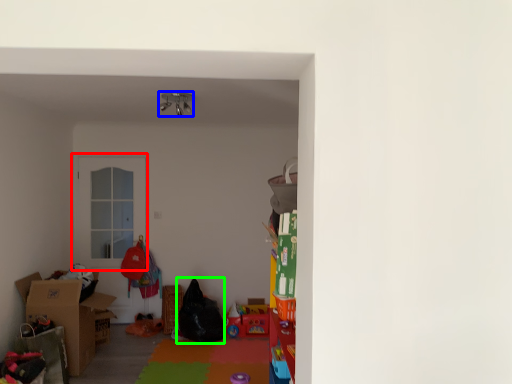
Question: Considering the real-world distances, which object is closest to door (highlighted by a red box)? lamp (highlighted by a blue box) or bean bag chair (highlighted by a green box).

Choices:
 (A) lamp
 (B) bean bag chair

Answer: (B)